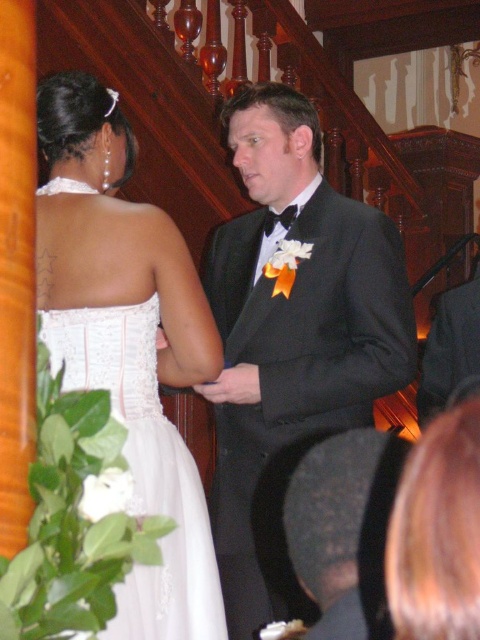
Can you confirm if black satin tuxedo at center is wider than white satin dress at center?

Yes.

In the scene shown: Does black satin tuxedo at center have a larger size compared to white satin dress at center?

No.

You are a GUI agent. You are given a task and a screenshot of the screen. Output one action in this format:
    pyautogui.click(x=<x>, y=<y>)
    Task: Click on the black satin tuxedo at center
    
    Given the screenshot: What is the action you would take?
    pyautogui.click(x=291, y=339)